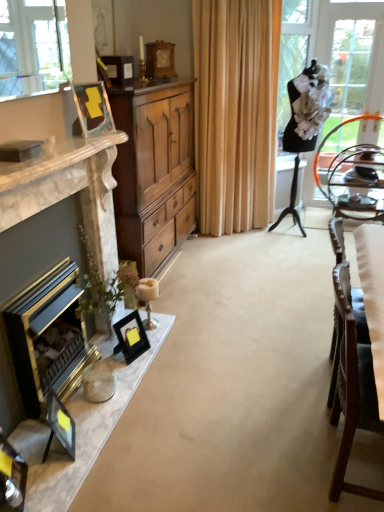
Question: From the image's perspective, does white fabric chair at right appear higher than matte black picture frame at lower left, the 5th picture frame when ordered from top to bottom?

Choices:
 (A) yes
 (B) no

Answer: (A)

Question: From the image's perspective, does white fabric chair at right appear lower than matte black picture frame at lower left, the first picture frame positioned from the front?

Choices:
 (A) yes
 (B) no

Answer: (B)

Question: Is the depth of white fabric chair at right less than that of matte black picture frame at lower left, placed as the first picture frame when sorted from bottom to top?

Choices:
 (A) no
 (B) yes

Answer: (B)

Question: Is white fabric chair at right touching matte black picture frame at lower left, the 5th picture frame when ordered from top to bottom?

Choices:
 (A) no
 (B) yes

Answer: (A)

Question: Is matte black picture frame at lower left, the first picture frame positioned from the front, a part of white fabric chair at right?

Choices:
 (A) yes
 (B) no

Answer: (B)

Question: Is white fabric chair at right thinner than matte black picture frame at lower left, the 5th picture frame when ordered from top to bottom?

Choices:
 (A) no
 (B) yes

Answer: (A)

Question: Is beige fabric curtain at center to the left of matte wood picture frame at upper left, which is counted as the third picture frame, starting from the bottom, from the viewer's perspective?

Choices:
 (A) no
 (B) yes

Answer: (A)

Question: Is beige fabric curtain at center completely or partially outside of matte wood picture frame at upper left, the 3th picture frame viewed from the top?

Choices:
 (A) yes
 (B) no

Answer: (A)

Question: Does beige fabric curtain at center have a smaller size compared to matte wood picture frame at upper left, the fourth picture frame from the back?

Choices:
 (A) no
 (B) yes

Answer: (A)

Question: Does beige fabric curtain at center have a lesser height compared to matte wood picture frame at upper left, the 3th picture frame viewed from the top?

Choices:
 (A) yes
 (B) no

Answer: (B)

Question: Is beige fabric curtain at center looking in the opposite direction of matte wood picture frame at upper left, the fourth picture frame from the back?

Choices:
 (A) no
 (B) yes

Answer: (A)

Question: Is beige fabric curtain at center positioned far away from matte wood picture frame at upper left, which is counted as the third picture frame, starting from the bottom?

Choices:
 (A) no
 (B) yes

Answer: (B)

Question: Considering the relative positions of marble fireplace at left, the second fireplace positioned from the back, and wooden cabinet at center in the image provided, is marble fireplace at left, the second fireplace positioned from the back, to the right of wooden cabinet at center from the viewer's perspective?

Choices:
 (A) no
 (B) yes

Answer: (A)